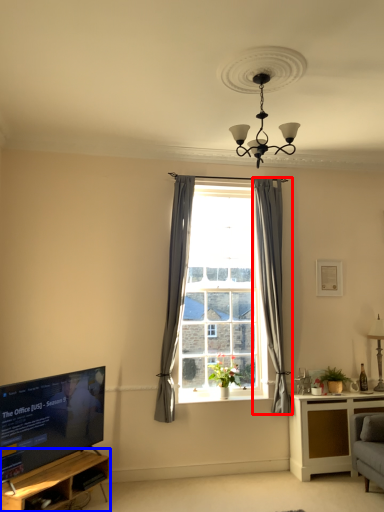
Question: Among these objects, which one is farthest to the camera, curtain (highlighted by a red box) or shelf (highlighted by a blue box)?

Choices:
 (A) curtain
 (B) shelf

Answer: (A)